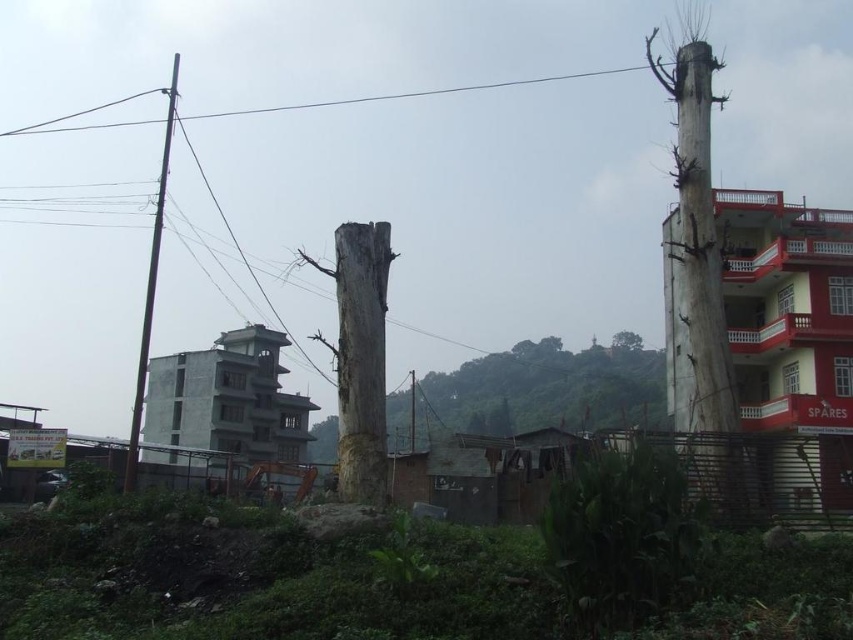
You are standing in the urban area and want to take a photo of both the smooth gray tree trunk at center and the brown wooden telegraph pole at left. Which object should you focus on first to ensure both are in the frame?

You should focus on the smooth gray tree trunk at center first because it is closer to you than the brown wooden telegraph pole at left, so adjusting the camera to include both would require starting with the closer object.

You are a city planner assessing the urban space. You notice the smooth gray tree trunk at center and the gray rough tree trunk at center. Which of these two trunks has a larger diameter?

The smooth gray tree trunk at center is bigger than the gray rough tree trunk at center, so it has a larger diameter.